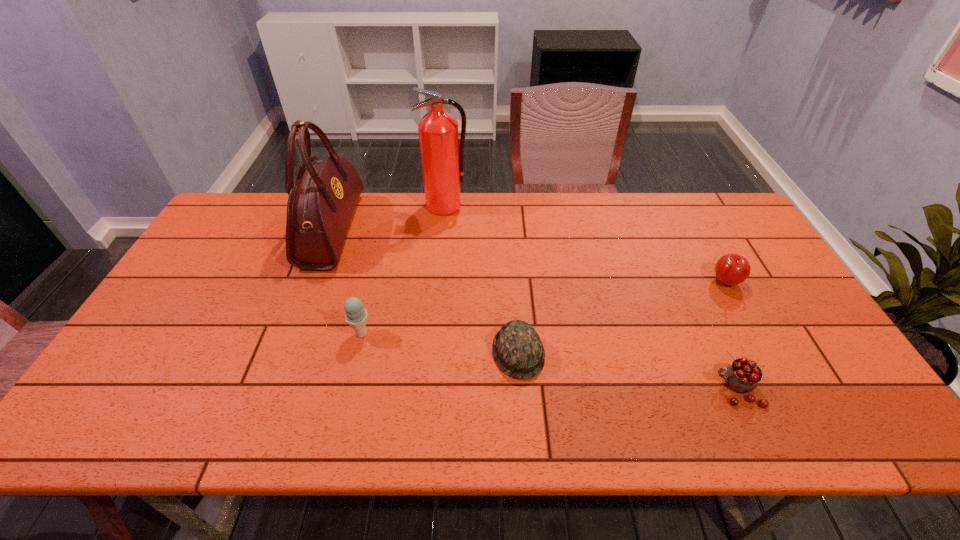
Locate an element on the screen. This screenshot has width=960, height=540. fire extinguisher is located at coordinates (442, 160).

The width and height of the screenshot is (960, 540). I want to click on handbag, so click(322, 198).

You are a GUI agent. You are given a task and a screenshot of the screen. Output one action in this format:
    pyautogui.click(x=<x>, y=<y>)
    Task: Click on the fifth object from right to left
    The width and height of the screenshot is (960, 540).
    Given the screenshot: What is the action you would take?
    pyautogui.click(x=356, y=316)

Find the location of a particular element. The width and height of the screenshot is (960, 540). the right cherry is located at coordinates (731, 269).

Identify the location of the farther cherry. The height and width of the screenshot is (540, 960). (731, 269).

This screenshot has height=540, width=960. Identify the location of the nearer cherry. (743, 375).

Locate an element on the screen. The height and width of the screenshot is (540, 960). the left cherry is located at coordinates (743, 375).

I want to click on headwear, so click(517, 348).

Image resolution: width=960 pixels, height=540 pixels. I want to click on the shortest object, so click(x=517, y=348).

Identify the location of blank space located at the nozzle of the fire extinguisher. (439, 268).